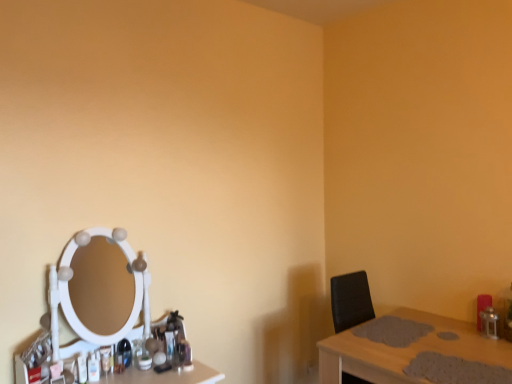
Locate an element on the screen. This screenshot has width=512, height=384. free space above wooden table at right (from a real-world perspective) is located at coordinates (412, 343).